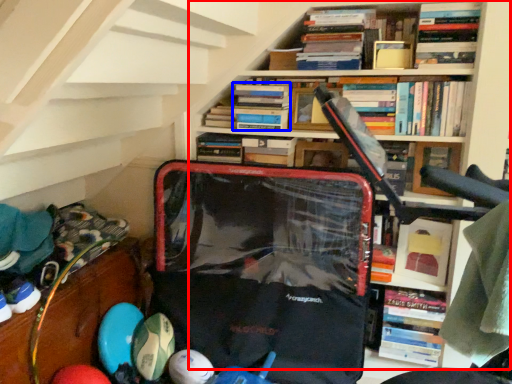
Question: Among these objects, which one is farthest to the camera, bookcase (highlighted by a red box) or book (highlighted by a blue box)?

Choices:
 (A) bookcase
 (B) book

Answer: (B)